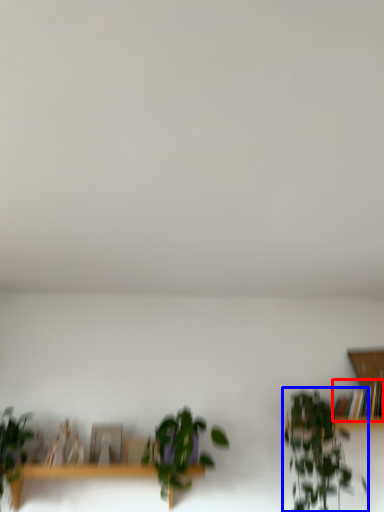
Question: Which point is further to the camera, book (highlighted by a red box) or houseplant (highlighted by a blue box)?

Choices:
 (A) book
 (B) houseplant

Answer: (A)